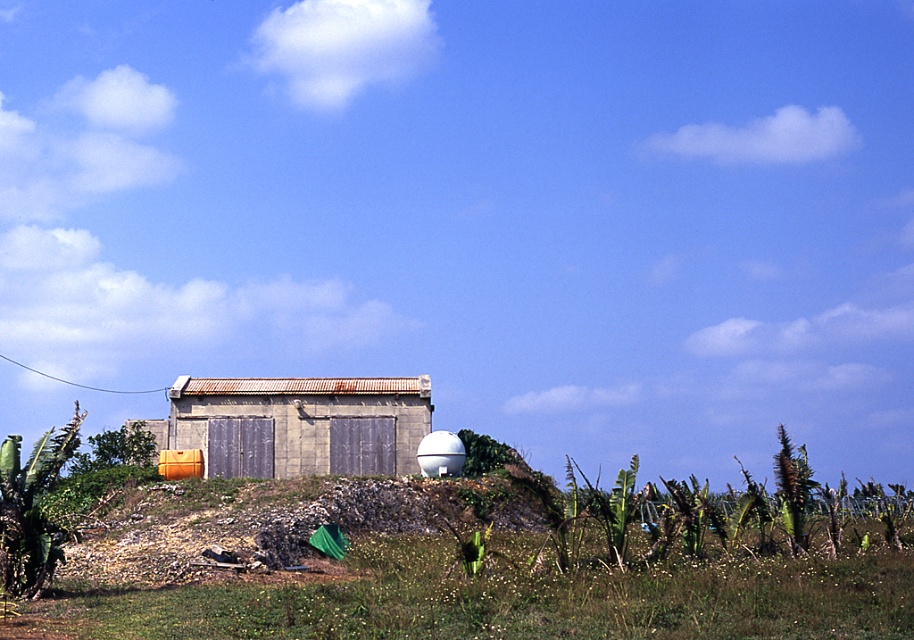
Who is more forward, (515, 550) or (458, 472)?

Positioned in front is point (515, 550).

Who is lower down, green grass at lower center or white matte water tank at center?

white matte water tank at center

Does point (761, 582) come closer to viewer compared to point (420, 461)?

Yes.

Locate an element on the screen. green grass at lower center is located at coordinates (502, 596).

Is green grass at lower center closer to camera compared to rusty concrete hut at center?

Yes, green grass at lower center is closer to the viewer.

Does green grass at lower center lie behind rusty concrete hut at center?

No.

Who is more distant from viewer, (546, 608) or (278, 458)?

Positioned behind is point (278, 458).

Locate an element on the screen. green grass at lower center is located at coordinates (502, 596).

Who is lower down, rusty concrete hut at center or white matte water tank at center?

white matte water tank at center

Who is shorter, rusty concrete hut at center or white matte water tank at center?

white matte water tank at center is shorter.

Between point (190, 390) and point (447, 448), which one is positioned in front?

Point (447, 448)

You are a GUI agent. You are given a task and a screenshot of the screen. Output one action in this format:
    pyautogui.click(x=<x>, y=<y>)
    Task: Click on the rusty concrete hut at center
    
    Given the screenshot: What is the action you would take?
    pyautogui.click(x=300, y=422)